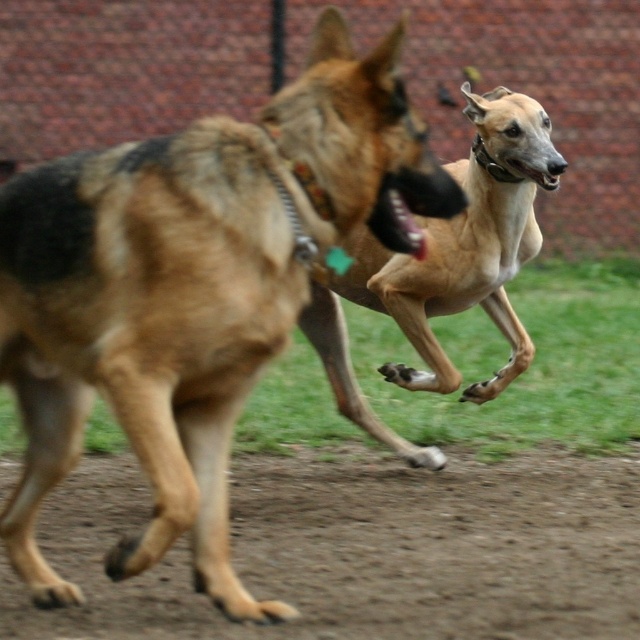
In the scene shown: Is brown dirt track at lower center below black glossy teeth at center?

Yes.

Image resolution: width=640 pixels, height=640 pixels. Find the location of `brown dirt track at lower center`. brown dirt track at lower center is located at coordinates (364, 548).

Which is behind, point (474, 493) or point (401, 248)?

The point (474, 493) is more distant.

Identify the location of brown dirt track at lower center. The width and height of the screenshot is (640, 640). (364, 548).

Between point (248, 508) and point (358, 396), which one is positioned in front?

Positioned in front is point (248, 508).

Is the position of brown dirt track at lower center more distant than that of light brown smooth dog at center?

No, brown dirt track at lower center is in front of light brown smooth dog at center.

Is point (586, 497) more distant than point (340, 412)?

No, (586, 497) is closer to viewer.

Locate an element on the screen. brown dirt track at lower center is located at coordinates (364, 548).

Who is lower down, brown fur dog at center or black glossy teeth at center?

brown fur dog at center

Is brown fur dog at center below black glossy teeth at center?

Yes, brown fur dog at center is below black glossy teeth at center.

Which is behind, point (292, 612) or point (404, 227)?

Point (292, 612)

What are the coordinates of `brown fur dog at center` in the screenshot? It's located at (192, 291).